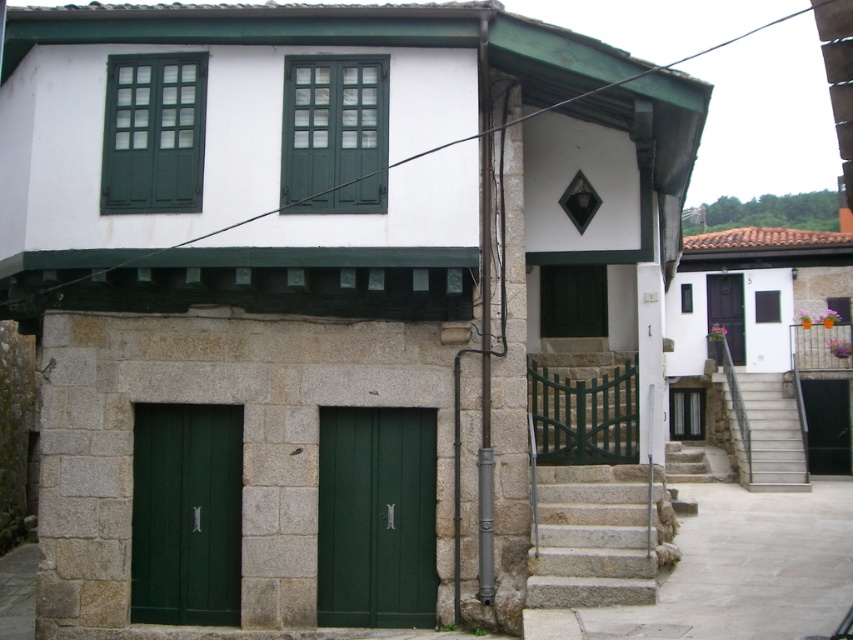
You are a painter who needs to decide whether to bring a ladder or a step stool to reach the green matte window at upper center. The concrete stairs at lower right are nearby. Based on their heights, which tool should you choose?

The green matte window at upper center is shorter than the concrete stairs at lower right, so a step stool would be sufficient to reach the green matte window at upper center since it is lower than the stairs.

You are a delivery person trying to enter the building. You need to choose between the green matte door at lower left and the black matte door at center. Which door is taller?

The green matte door at lower left is taller than the black matte door at center.